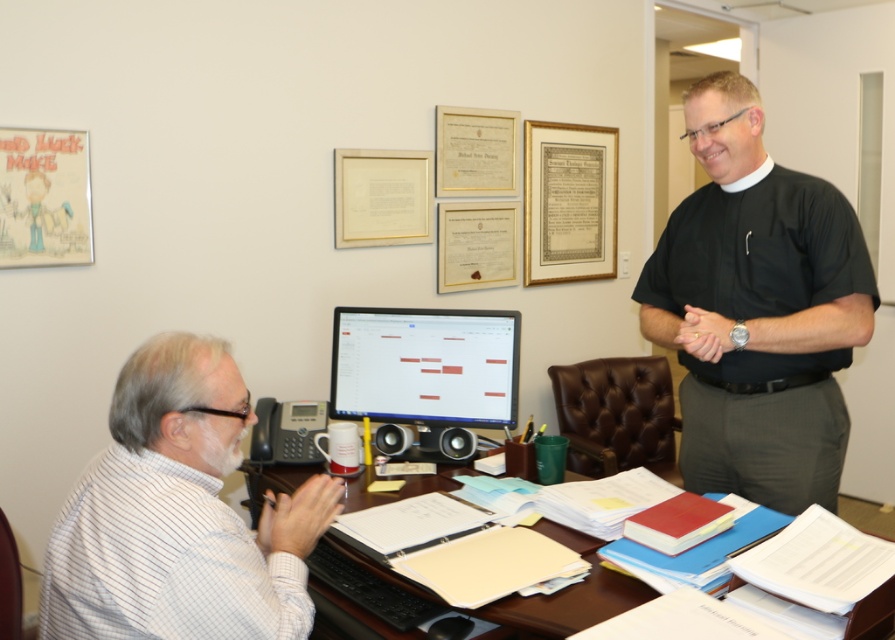
Question: Among these objects, which one is farthest from the camera?

Choices:
 (A) matte black monitor at center
 (B) white paper at center

Answer: (A)

Question: Estimate the real-world distances between objects in this image. Which object is closer to the matte black monitor at center?

Choices:
 (A) black matte shirt at right
 (B) white paper at center
 (C) white striped shirt at left

Answer: (B)

Question: Can you confirm if black matte shirt at right is wider than matte black monitor at center?

Choices:
 (A) no
 (B) yes

Answer: (A)

Question: Does black matte shirt at right come behind white striped shirt at left?

Choices:
 (A) yes
 (B) no

Answer: (A)

Question: Estimate the real-world distances between objects in this image. Which object is closer to the black matte shirt at right?

Choices:
 (A) white paper at center
 (B) matte black monitor at center

Answer: (B)

Question: Does matte black monitor at center appear under white paper at center?

Choices:
 (A) no
 (B) yes

Answer: (A)